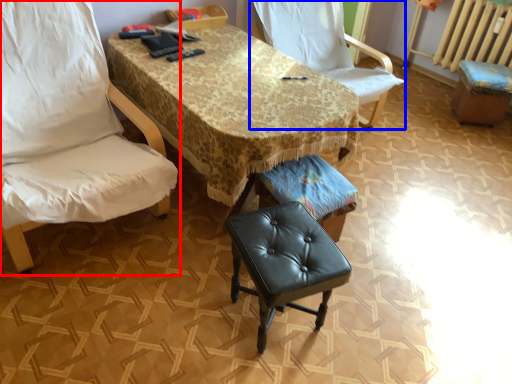
Question: Which point is closer to the camera, chair (highlighted by a red box) or chair (highlighted by a blue box)?

Choices:
 (A) chair
 (B) chair

Answer: (A)